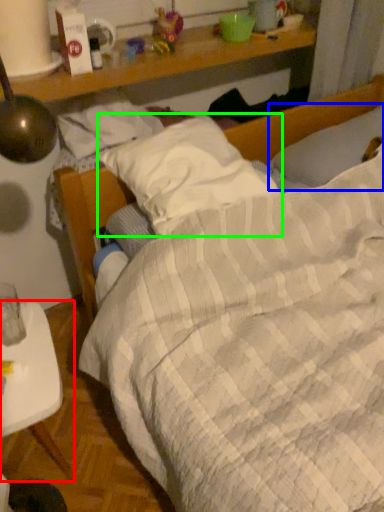
Question: Which object is the closest to the desk (highlighted by a red box)? Choose among these: pillow (highlighted by a blue box) or pillow (highlighted by a green box).

Choices:
 (A) pillow
 (B) pillow

Answer: (B)